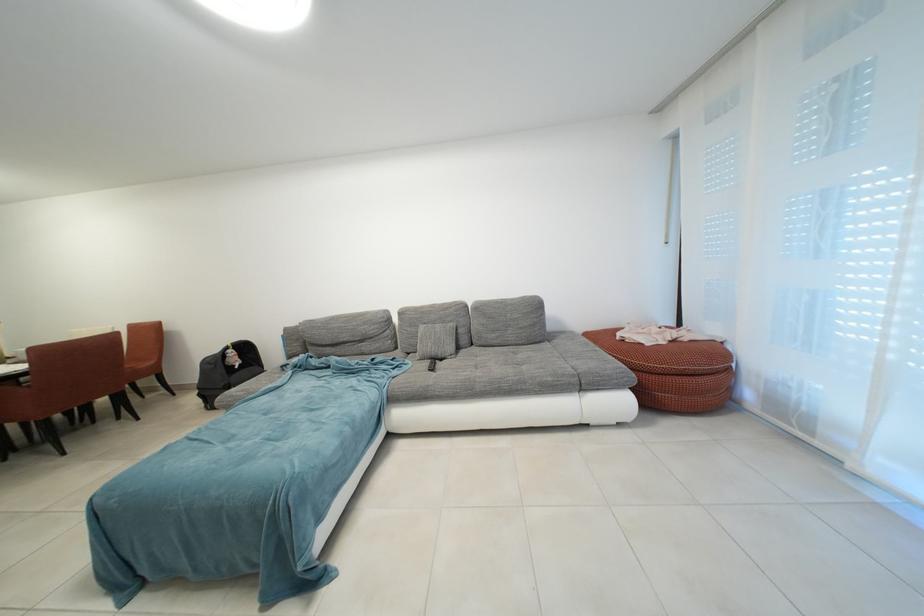
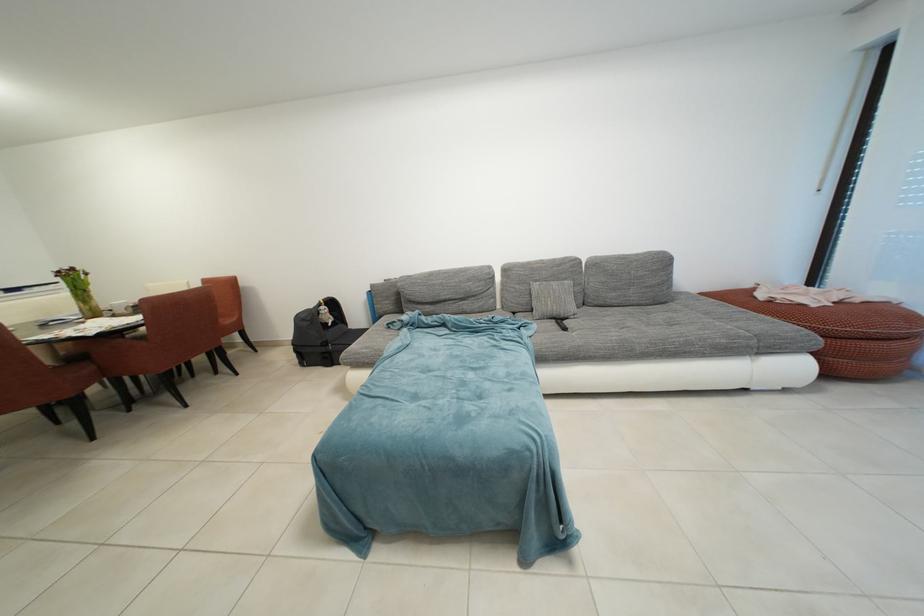
Locate, in the second image, the point that corresponds to (x=453, y=309) in the first image.

(563, 264)